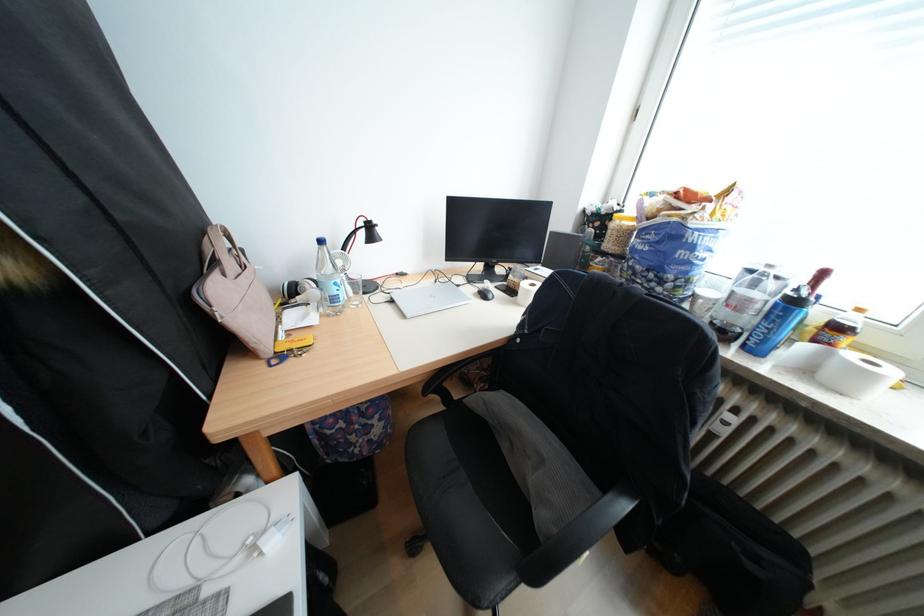
The image size is (924, 616). Identify the location of black computer mouse. (485, 292).